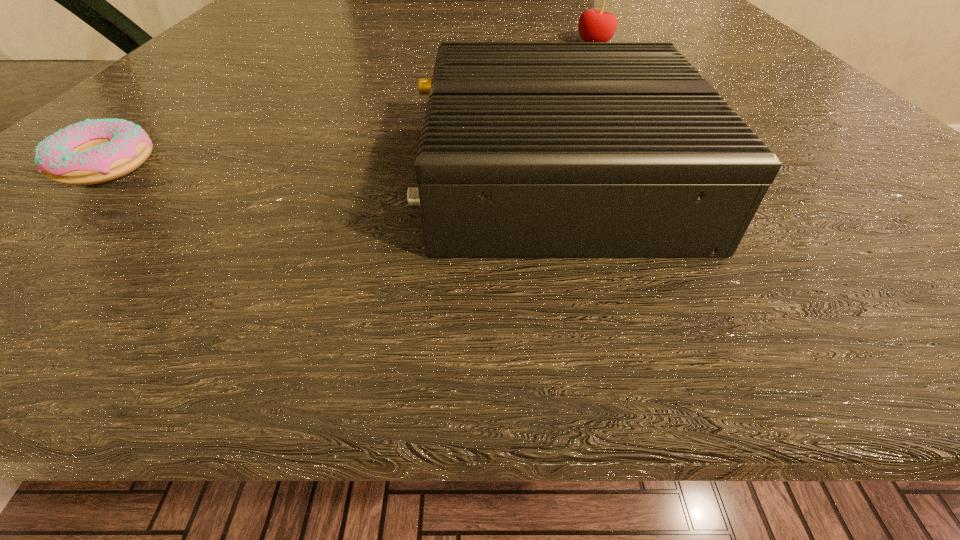
Find the location of a particular element. The image size is (960, 540). cherry is located at coordinates (595, 25).

Locate an element on the screen. The image size is (960, 540). the tallest object is located at coordinates (595, 25).

At what (x,y) coordinates should I click in order to perform the action: click on the second tallest object. Please return your answer as a coordinate pair (x, y). This screenshot has width=960, height=540. Looking at the image, I should click on (528, 149).

Where is `the leftmost object`? the leftmost object is located at coordinates (95, 151).

At what (x,y) coordinates should I click in order to perform the action: click on the shortest object. Please return your answer as a coordinate pair (x, y). This screenshot has height=540, width=960. Looking at the image, I should click on (95, 151).

Where is `free space located on the right of the tallest object`? This screenshot has width=960, height=540. free space located on the right of the tallest object is located at coordinates (667, 44).

Find the location of a particular element. vacant space located 0.280m on the back panel of the router is located at coordinates (105, 178).

At what (x,y) coordinates should I click in order to perform the action: click on free space located on the back panel of the router. Please return your answer as a coordinate pair (x, y). Image resolution: width=960 pixels, height=540 pixels. Looking at the image, I should click on (327, 178).

This screenshot has width=960, height=540. What are the coordinates of `vacant space located 0.210m on the back panel of the router` in the screenshot? It's located at (182, 178).

Locate an element on the screen. The width and height of the screenshot is (960, 540). vacant space situated on the back of the leftmost object is located at coordinates (252, 36).